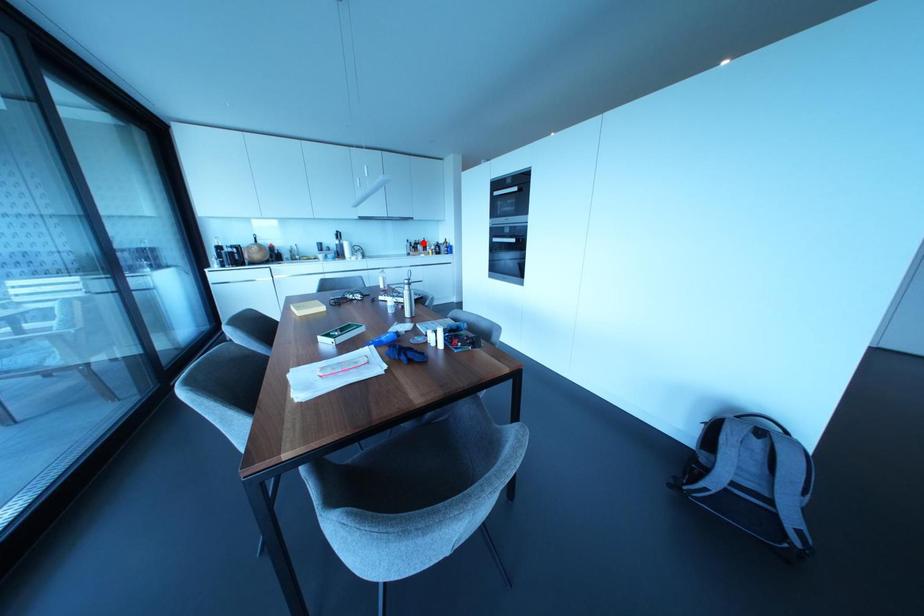
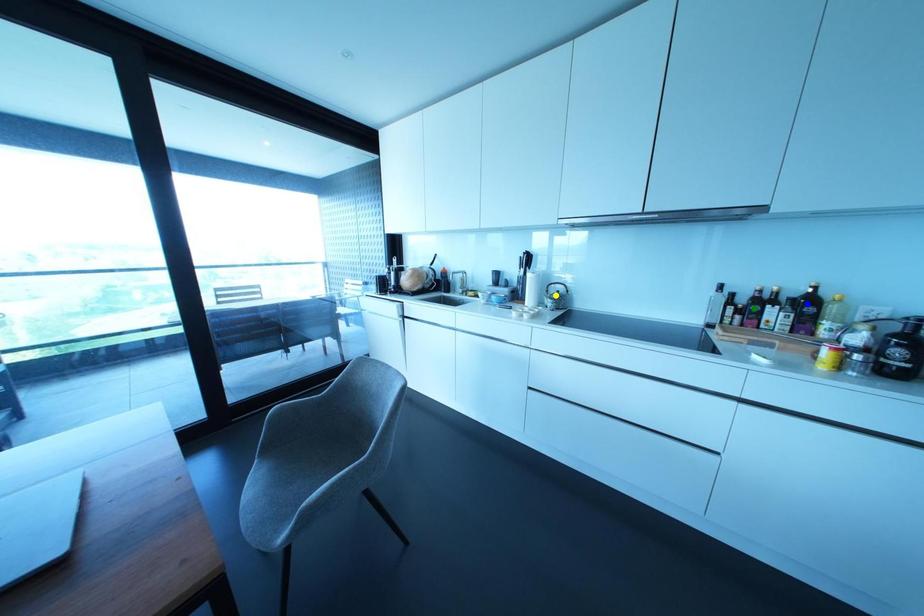
Question: I am providing you with two images of the same scene from different viewpoints. A red point is marked on the first image. You are given multiple points on the second image. Which spot in image 2 lines up with the point in image 1?

Choices:
 (A) blue point
 (B) yellow point
 (C) green point

Answer: (A)